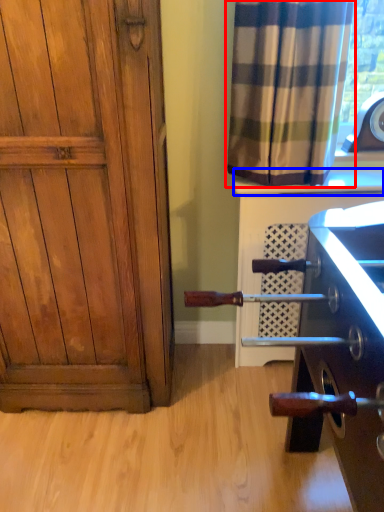
Question: Which object is further to the camera taking this photo, curtain (highlighted by a red box) or window sill (highlighted by a blue box)?

Choices:
 (A) curtain
 (B) window sill

Answer: (B)